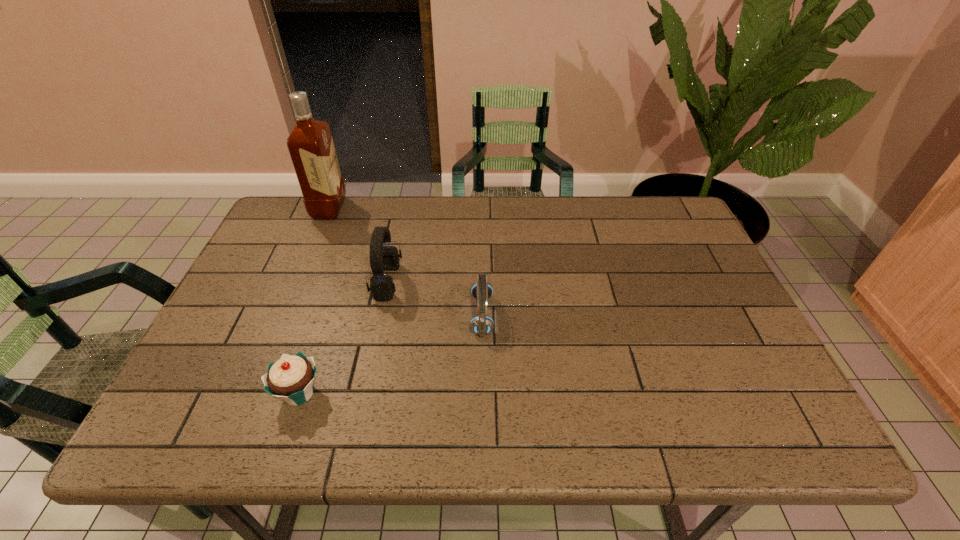
This screenshot has width=960, height=540. I want to click on vacant space at the left edge of the desktop, so click(253, 394).

At what (x,y) coordinates should I click in order to perform the action: click on vacant region at the right edge. Please return your answer as a coordinate pair (x, y). The image size is (960, 540). Looking at the image, I should click on point(730,314).

In the image, there is a desktop. Identify the location of vacant region at the far right corner. (636, 212).

Identify the location of free area in between the right headset and the third shortest object. The width and height of the screenshot is (960, 540). (435, 299).

Identify the location of vacant point located between the shorter headset and the left headset. (435, 299).

Identify the location of vacant area that lies between the third object from left to right and the leftmost object. Image resolution: width=960 pixels, height=540 pixels. (358, 246).

You are a GUI agent. You are given a task and a screenshot of the screen. Output one action in this format:
    pyautogui.click(x=<x>, y=<y>)
    Task: Click on the vacant region between the third object from right to left and the taller headset
    
    Given the screenshot: What is the action you would take?
    pyautogui.click(x=344, y=338)

You are a GUI agent. You are given a task and a screenshot of the screen. Output one action in this format:
    pyautogui.click(x=<x>, y=<y>)
    Task: Click on the free space between the shorter headset and the leftmost object
    This screenshot has width=960, height=540.
    Given the screenshot: What is the action you would take?
    pyautogui.click(x=406, y=262)

Locate an element on the screen. free space between the liquor and the third object from right to left is located at coordinates (314, 301).

Find the location of `vacant area that lies between the second object from right to left and the shorter headset`. vacant area that lies between the second object from right to left and the shorter headset is located at coordinates (435, 299).